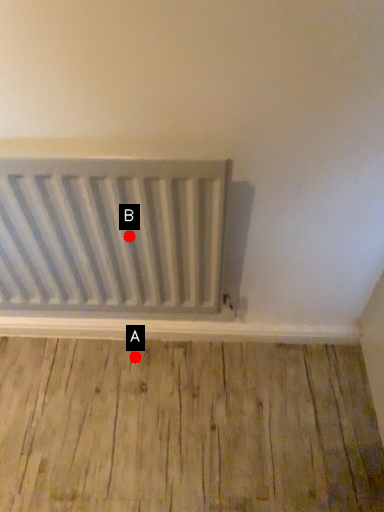
Question: Two points are circled on the image, labeled by A and B beside each circle. Which point is closer to the camera taking this photo?

Choices:
 (A) A is closer
 (B) B is closer

Answer: (B)